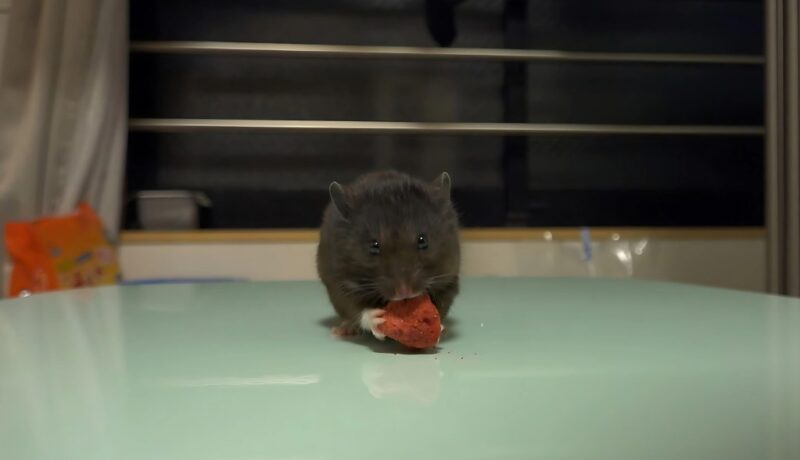
Find the location of a particular element. shelf is located at coordinates (526, 119), (365, 51).